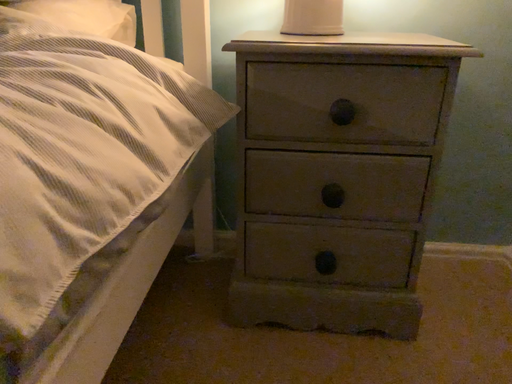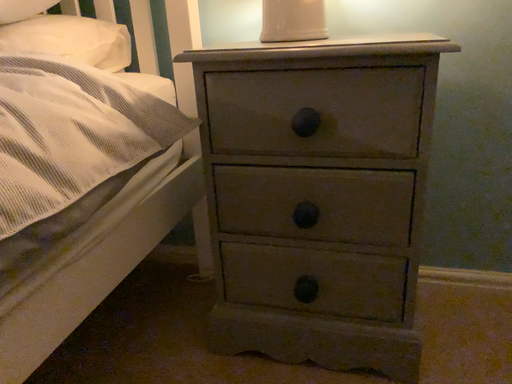
Question: How did the camera likely rotate when shooting the video?

Choices:
 (A) rotated left
 (B) rotated right

Answer: (A)